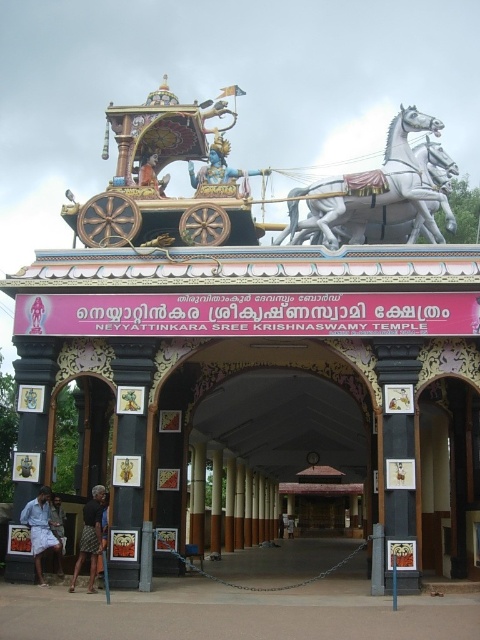
You are a visitor standing at the entrance of Neyyattinkara Sree Krishnaswamy Temple. You notice a white glossy horse at upper center and a dark brown woven skirt at lower left. Which object is taller?

The white glossy horse at upper center is taller than the dark brown woven skirt at lower left.

You are an architect analyzing the temple entrance. You need to place a new decorative element exactly at the position of the white glossy horse at upper center. What coordinates should you use for placement?

The position of the white glossy horse at upper center is at point (381,211), so you should place the new decorative element at coordinates (381,211).